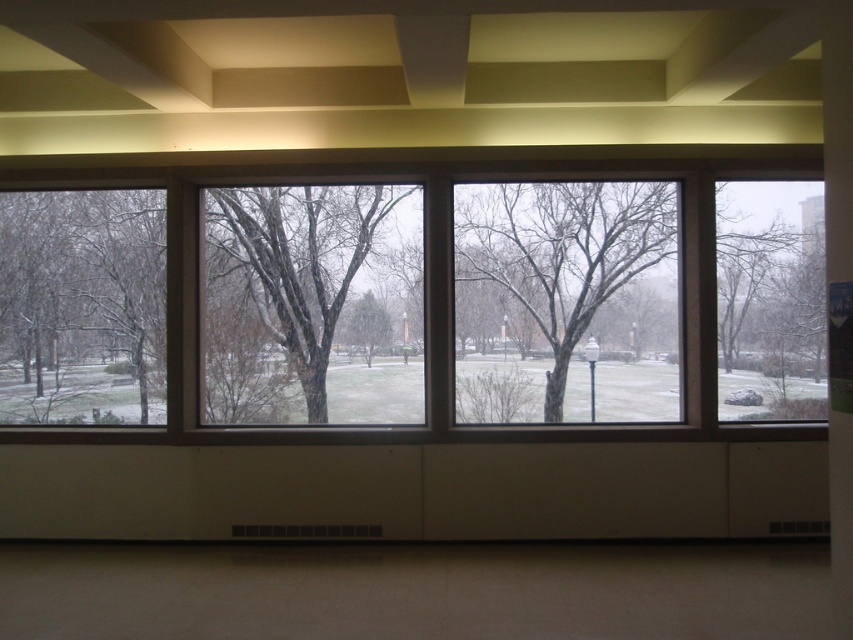
Is clear glass window at center bigger than green matte tree at center?

Incorrect, clear glass window at center is not larger than green matte tree at center.

Does clear glass window at center appear under green matte tree at center?

Incorrect, clear glass window at center is not positioned below green matte tree at center.

Which is in front, point (231, 355) or point (367, 346)?

Positioned in front is point (367, 346).

Where is `clear glass window at center`? The height and width of the screenshot is (640, 853). clear glass window at center is located at coordinates (294, 291).

Does clear glass window at center have a greater width compared to bare branches at center?

In fact, clear glass window at center might be narrower than bare branches at center.

Can you confirm if clear glass window at center is bigger than bare branches at center?

No.

Does point (682, 352) come farther from viewer compared to point (564, 285)?

No, (682, 352) is closer to viewer.

Find the location of a particular element. The image size is (853, 640). clear glass window at center is located at coordinates (294, 291).

Is point (641, 240) closer to camera compared to point (384, 330)?

Yes.

What are the coordinates of `bare branches at center` in the screenshot? It's located at (566, 301).